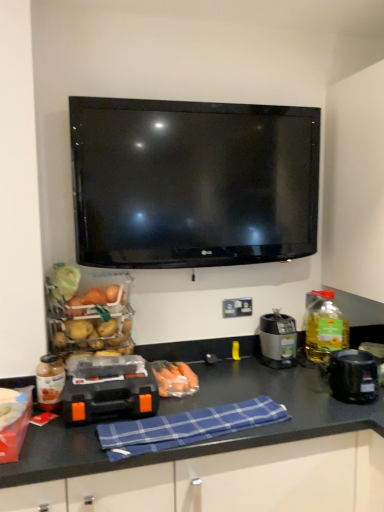
Question: In terms of width, does translucent plastic carrots at center, the second food from the left, look wider or thinner when compared to matte plastic basket of vegetables at left, positioned as the 2th food in bottom-to-top order?

Choices:
 (A) wide
 (B) thin

Answer: (A)

Question: Considering the positions of point (173, 376) and point (104, 316), is point (173, 376) closer or farther from the camera than point (104, 316)?

Choices:
 (A) farther
 (B) closer

Answer: (B)

Question: Which is farther from the blue plaid cloth at center?

Choices:
 (A) satin silver coffee maker at center-right, which appears as the 3th appliance when viewed from the front
 (B) black plastic coffee maker at right, which appears as the 1th appliance when viewed from the right
 (C) orange plastic toolbox at center, marked as the first appliance in a front-to-back arrangement
 (D) matte plastic basket of vegetables at left, acting as the first food starting from the left
 (E) yellow translucent bottle at right, the first bottle in the right-to-left sequence

Answer: (E)

Question: Estimate the real-world distances between objects in this image. Which object is farther from the translucent glass bottle at left, marked as the 1th bottle in a front-to-back arrangement?

Choices:
 (A) satin silver coffee maker at center-right, which appears as the 3th appliance when viewed from the front
 (B) blue plaid cloth at center
 (C) matte plastic basket of vegetables at left, which appears as the second food when viewed from the right
 (D) translucent plastic carrots at center, which is counted as the first food, starting from the right
 (E) yellow translucent bottle at right, the first bottle in the right-to-left sequence

Answer: (E)